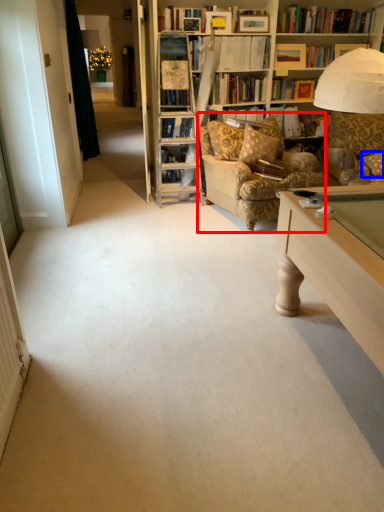
Question: Which object is further to the camera taking this photo, chair (highlighted by a red box) or pillow (highlighted by a blue box)?

Choices:
 (A) chair
 (B) pillow

Answer: (B)